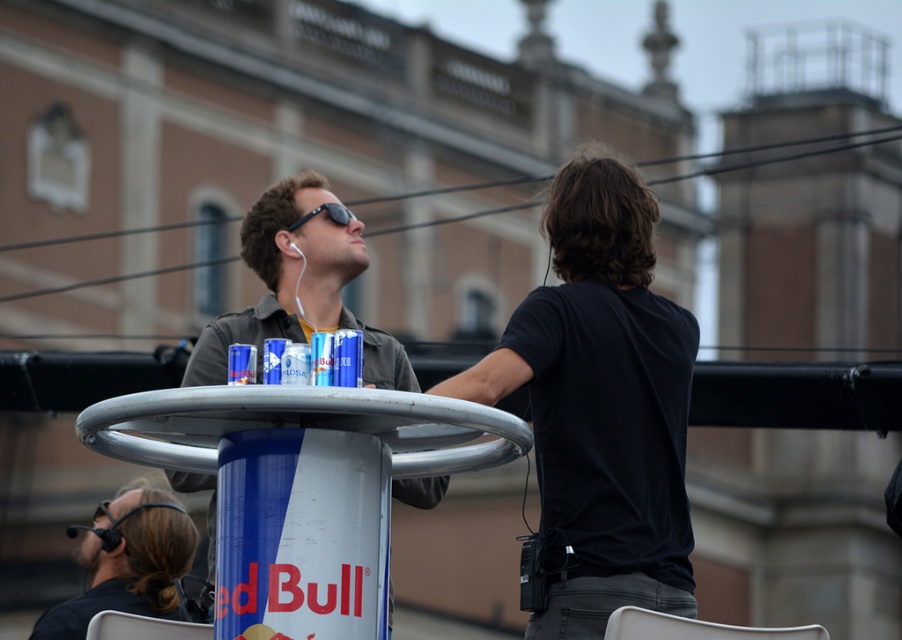
You are a photographer standing at the edge of the rooftop. You see the black matte shirt at center and the brown hair at lower left. Which object is located to the right of the other?

The black matte shirt at center is positioned on the right side of brown hair at lower left.

You are a photographer trying to capture a closeup of the Red Bull logo on the table. You notice two items in the way, the black matte shirt at center and the matte black jacket at center. Which item should you move to get a clearer view of the logo?

The black matte shirt at center has a smaller size compared to the matte black jacket at center, so moving the smaller black matte shirt at center would be more effective to clear the view of the Red Bull logo.

You are a photographer positioned to capture the scene from the rooftop. You notice the black matte shirt at center and the brown hair at lower left. Which object is taller in the image?

The black matte shirt at center is taller than the brown hair at lower left according to the description.